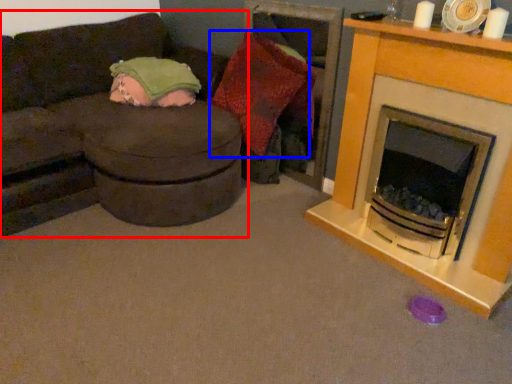
Question: Which object is closer to the camera taking this photo, studio couch (highlighted by a red box) or pillow (highlighted by a blue box)?

Choices:
 (A) studio couch
 (B) pillow

Answer: (A)